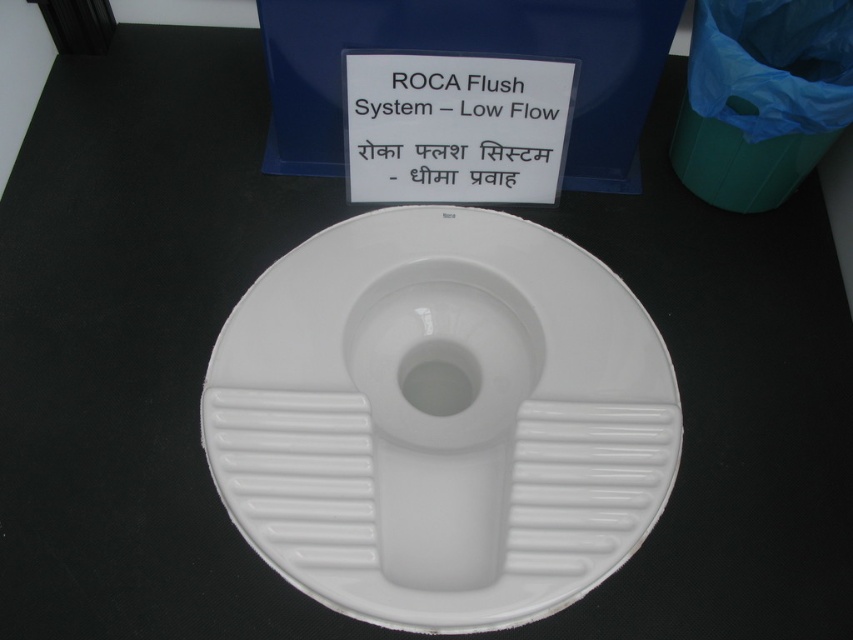
Measure the distance between white glossy toilet bowl at center and white plastic sign at center.

10.72 inches

Measure the distance between point [375,477] and camera.

Point [375,477] is 38.20 inches from camera.

Is point (427, 458) farther from viewer compared to point (450, 180)?

No, it is not.

Find the location of a particular element. white glossy toilet bowl at center is located at coordinates (442, 413).

Between point (325, 257) and point (480, 113), which one is positioned in front?

Point (325, 257)

Is point (592, 483) positioned in front of point (532, 96)?

Yes, point (592, 483) is closer to viewer.

Between point (531, 525) and point (550, 195), which one is positioned in front?

Point (531, 525)

I want to click on white glossy toilet seat at center, so click(440, 419).

Can you confirm if white glossy toilet seat at center is wider than white glossy toilet bowl at center?

Correct, the width of white glossy toilet seat at center exceeds that of white glossy toilet bowl at center.

Is white glossy toilet seat at center closer to the viewer compared to white glossy toilet bowl at center?

Yes, white glossy toilet seat at center is closer to the viewer.

Does point (242, 440) lie behind point (436, 282)?

No, it is not.

The image size is (853, 640). Identify the location of white glossy toilet seat at center. coord(440,419).